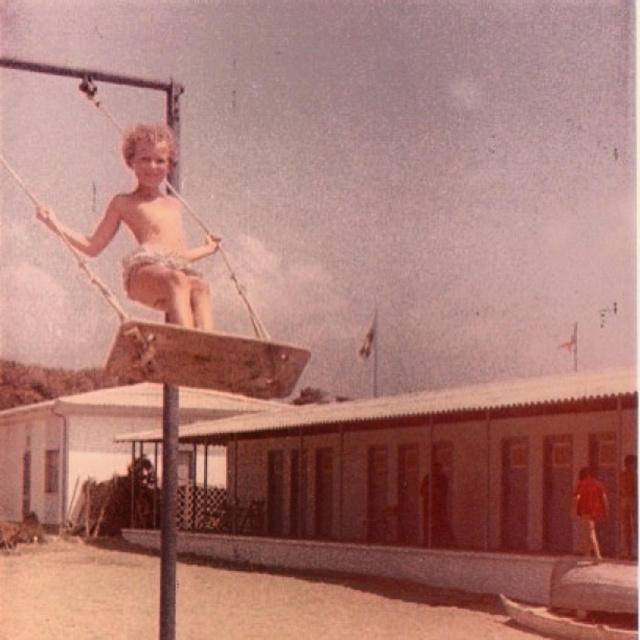
Question: Is light brown wooden swing at upper center below smooth skin shirtless boy at center?

Choices:
 (A) yes
 (B) no

Answer: (B)

Question: Among these objects, which one is farthest from the camera?

Choices:
 (A) metallic pole at center
 (B) smooth skin shirtless boy at center
 (C) wooden swing at center

Answer: (B)

Question: Does wooden swing at center have a smaller size compared to light brown wooden swing at upper center?

Choices:
 (A) yes
 (B) no

Answer: (B)

Question: Which point is closer to the camera?

Choices:
 (A) (589, 525)
 (B) (241, 355)
 (C) (451, 529)

Answer: (B)

Question: Which point is farther from the camera taking this photo?

Choices:
 (A) (115, 204)
 (B) (45, 65)
 (C) (172, 422)

Answer: (B)

Question: In this image, where is wooden swing at center located relative to smooth skin shirtless boy at center?

Choices:
 (A) below
 (B) above

Answer: (B)